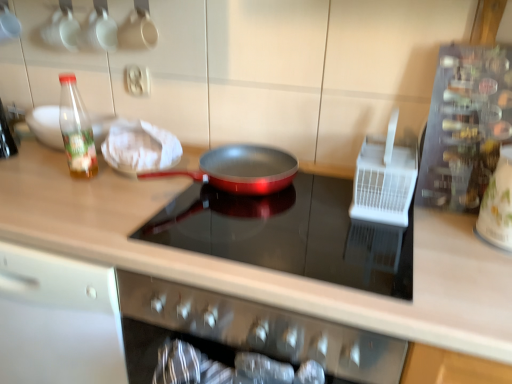
Where is `vacant area that lies between transparent plastic bottle at left and white glossy jar at right, the 3th appliance positioned from the left`? vacant area that lies between transparent plastic bottle at left and white glossy jar at right, the 3th appliance positioned from the left is located at coordinates (313, 212).